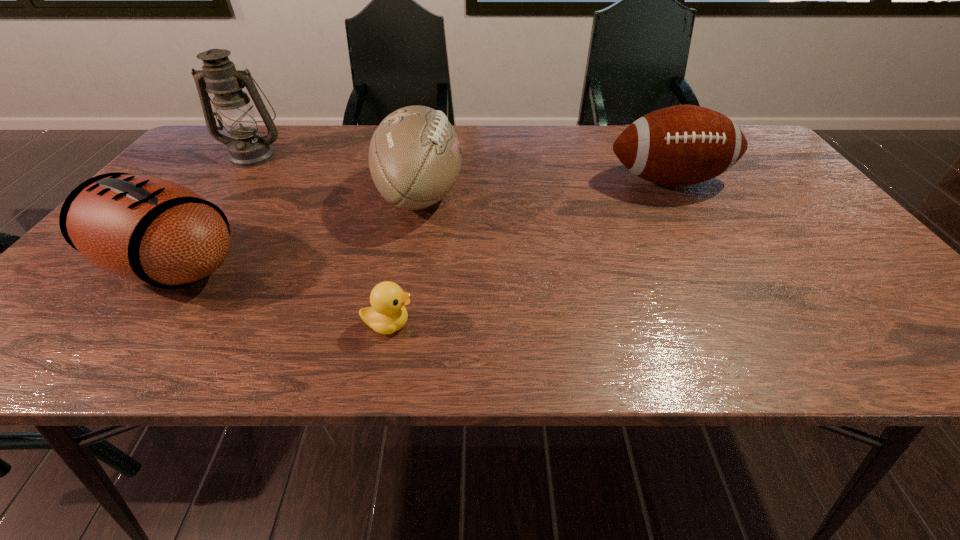
Find the location of a particular element. vacant point located between the duck and the rightmost football (American) is located at coordinates tap(528, 253).

Where is `vacant point located between the second football (American) from left to right and the shortest object`? The width and height of the screenshot is (960, 540). vacant point located between the second football (American) from left to right and the shortest object is located at coordinates (404, 259).

The width and height of the screenshot is (960, 540). I want to click on empty location between the second football (American) from left to right and the duck, so click(x=404, y=259).

Where is `free space that is in between the second football (American) from left to right and the rightmost object`? free space that is in between the second football (American) from left to right and the rightmost object is located at coordinates (544, 188).

I want to click on free space between the leftmost football (American) and the second football (American) from right to left, so click(x=297, y=230).

The image size is (960, 540). I want to click on empty location between the shortest object and the leftmost football (American), so click(x=280, y=295).

Locate an element on the screen. Image resolution: width=960 pixels, height=540 pixels. free space between the second football (American) from right to left and the duck is located at coordinates (404, 259).

The width and height of the screenshot is (960, 540). In order to click on vacant point located between the oil lamp and the second football (American) from right to left in this screenshot , I will do `click(337, 175)`.

Where is `object that is the third closest to the rightmost football (American)`? object that is the third closest to the rightmost football (American) is located at coordinates (144, 229).

Identify which object is located as the second nearest to the leftmost football (American). Please provide its 2D coordinates. Your answer should be formatted as a tuple, i.e. [(x, y)], where the tuple contains the x and y coordinates of a point satisfying the conditions above.

[(388, 314)]